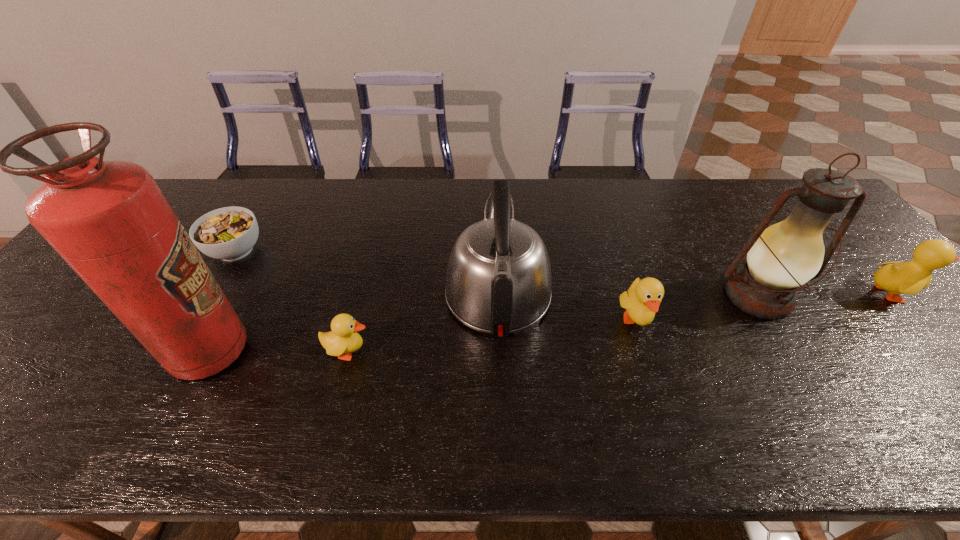
This screenshot has width=960, height=540. In order to click on object located in the right edge section of the desktop in this screenshot , I will do `click(911, 277)`.

Image resolution: width=960 pixels, height=540 pixels. In the image, there is a desktop. What are the coordinates of `free region at the far edge` in the screenshot? It's located at (620, 192).

The height and width of the screenshot is (540, 960). I want to click on vacant position at the near edge of the desktop, so click(681, 368).

Where is `vacant space at the left edge`? This screenshot has width=960, height=540. vacant space at the left edge is located at coordinates (47, 302).

Locate an element on the screen. vacant space at the right edge is located at coordinates (908, 345).

Identify the location of vacant space at the far right corner of the desktop. (790, 184).

In order to click on empty space that is in between the fourth object from left to right and the shortest object in this screenshot , I will do `click(367, 272)`.

Identify the location of free spot between the third shortest object and the fire extinguisher. (x=422, y=336).

Where is `free space between the third tallest object and the leftmost duckling`? The width and height of the screenshot is (960, 540). free space between the third tallest object and the leftmost duckling is located at coordinates (423, 322).

Locate an element on the screen. This screenshot has width=960, height=540. free spot between the sixth object from left to right and the shortest duckling is located at coordinates (554, 324).